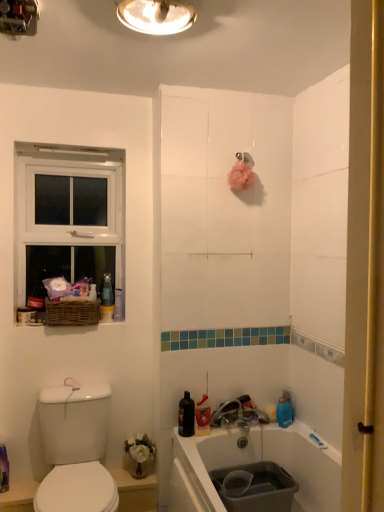
Question: From a real-world perspective, is metallic ceiling light at upper center, which is the 2th light fixture in right-to-left order, positioned above or below white glossy bidet at lower left?

Choices:
 (A) below
 (B) above

Answer: (B)

Question: In terms of size, does metallic ceiling light at upper center, which is the 2th light fixture in right-to-left order, appear bigger or smaller than white glossy bidet at lower left?

Choices:
 (A) big
 (B) small

Answer: (B)

Question: Which is nearer to the white glossy bidet at lower left?

Choices:
 (A) woven brown basket at left
 (B) metallic dome at upper center, which ranks as the first light fixture in right-to-left order
 (C) white glossy sink at lower left
 (D) white plastic window at upper left
 (E) metallic silver faucet at lower center

Answer: (C)

Question: Which object is positioned farthest from the metallic dome at upper center, which ranks as the first light fixture in right-to-left order?

Choices:
 (A) white glossy bidet at lower left
 (B) woven brown basket at left
 (C) metallic silver faucet at lower center
 (D) white glossy sink at lower left
 (E) metallic ceiling light at upper center, which is the 2th light fixture in right-to-left order

Answer: (A)